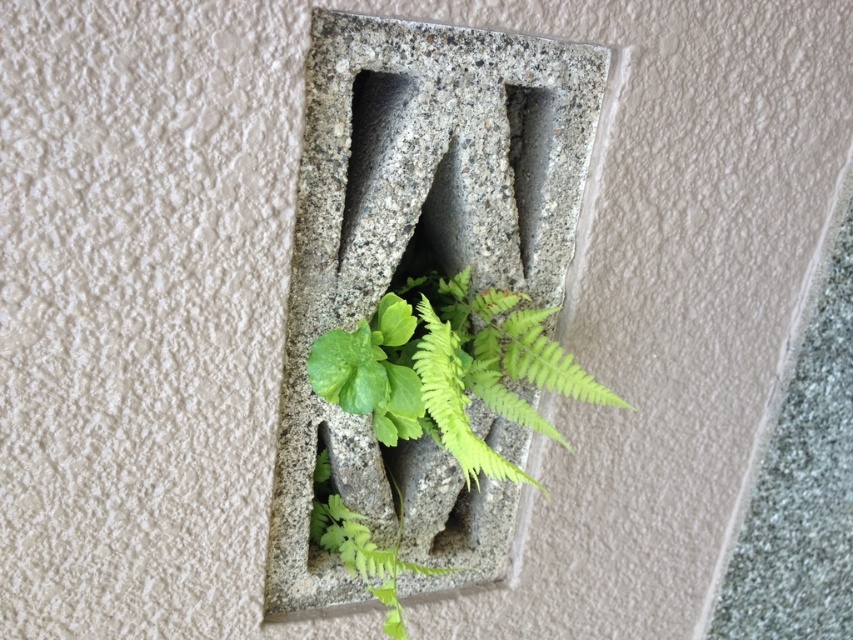
Consider the image. You are an architect designing a new building and want to place a plant in the exact center of the granite stone at center. Based on the image, where should you position the plant?

The granite stone at center is located at point (426, 259), so the plant should be placed at that coordinate to be centered.